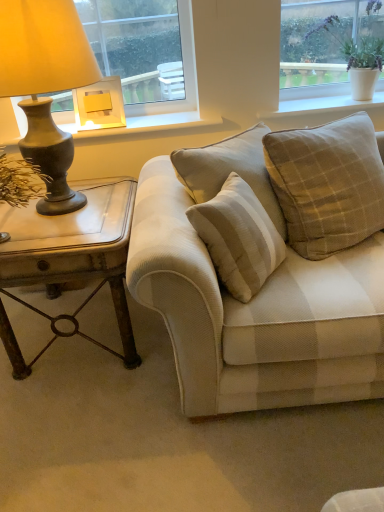
This screenshot has width=384, height=512. Find the location of `vacant space to the right of matte gold lampshade at upper left, the first lamp viewed from the back`. vacant space to the right of matte gold lampshade at upper left, the first lamp viewed from the back is located at coordinates (139, 123).